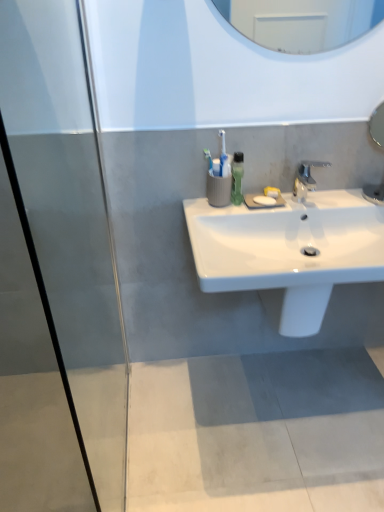
Question: From the image's perspective, is white glossy sink at center located above or below green matte soap dispenser at upper center?

Choices:
 (A) below
 (B) above

Answer: (A)

Question: Is white glossy sink at center to the left or to the right of green matte soap dispenser at upper center in the image?

Choices:
 (A) right
 (B) left

Answer: (A)

Question: Which object is positioned closest to the white glossy sink at center?

Choices:
 (A) silver metallic faucet at center
 (B) green matte soap dispenser at upper center

Answer: (A)

Question: Based on their relative distances, which object is nearer to the white glossy sink at center?

Choices:
 (A) silver metallic faucet at center
 (B) green matte soap dispenser at upper center

Answer: (A)